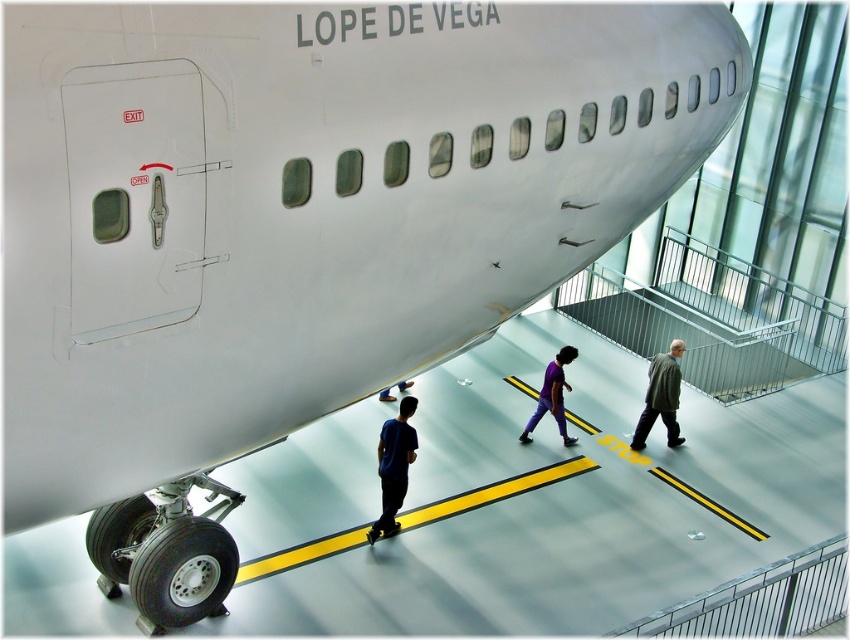
You are an interior designer tasked with placing a new decorative item in the museum where the Boeing 747 is displayed. The item must be placed exactly where the green matte coat at center is currently located. What are the coordinates of the spot where you should place the new item?

The coordinates for the green matte coat at center are at point (661, 396). You should place the new item at those coordinates.

You are standing in front of the Boeing 747 labeled LOPE DE VEGA in a museum. You notice two points marked on the aircraft. The first point is at coordinates point (667, 380) and the second is at point (556, 372). Which of these points is closer to you?

Point (667, 380) is closer to the viewer than point (556, 372).

You are standing in front of the Boeing 747 labeled LOPE DE VEGA in the museum. You notice two points marked on the aircraft. The first point is at coordinates point [667,360] and the second is at point [387,397]. Which of these points is closer to you?

Point [667,360] is closer to you because it is closer to the camera than point [387,397].